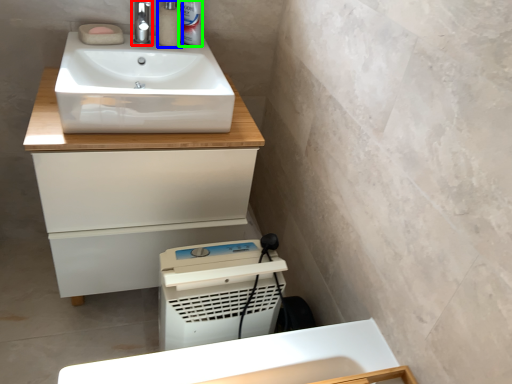
Question: Estimate the real-world distances between objects in this image. Which object is closer to tap (highlighted by a red box), soap dispenser (highlighted by a blue box) or toiletry (highlighted by a green box)?

Choices:
 (A) soap dispenser
 (B) toiletry

Answer: (A)